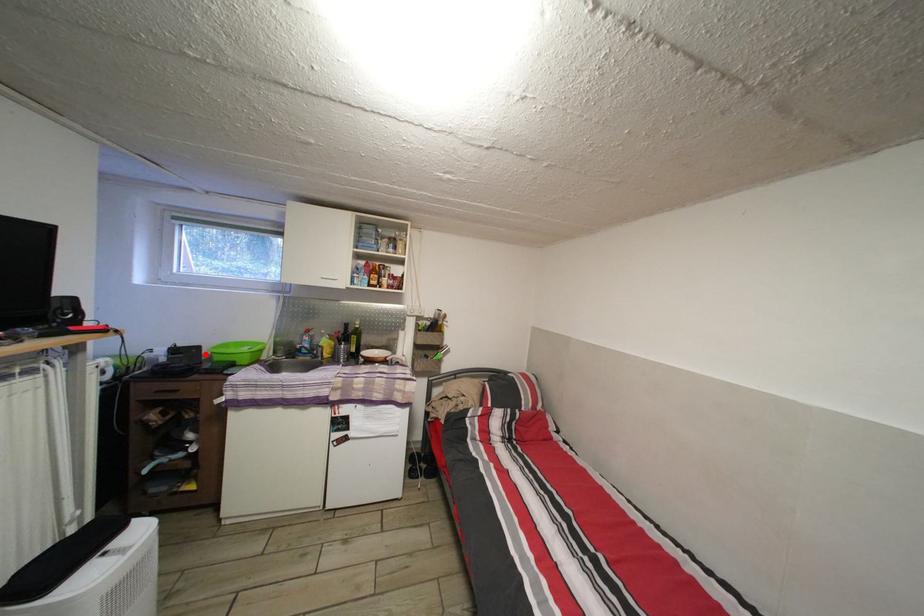
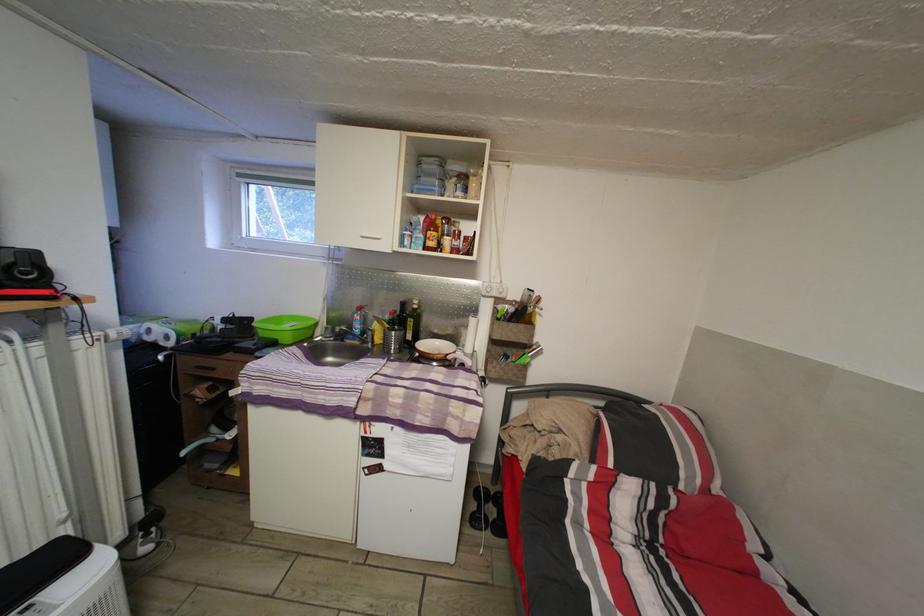
Locate, in the second image, the point that corresponds to the highlighted location in the first image.

(257, 326)